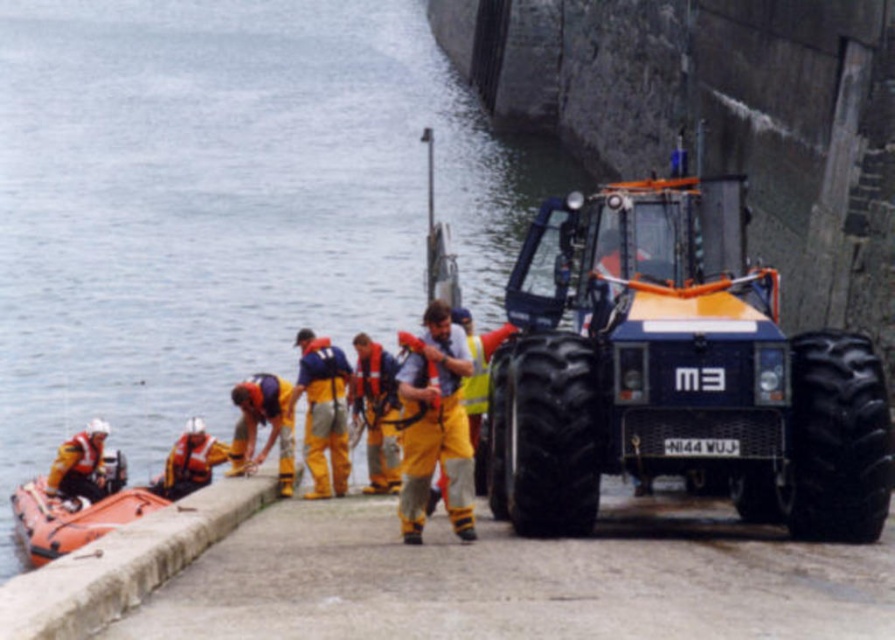
You are a safety inspector at the harbor. You need to ensure that the orange rubber boat at lower left can safely launch into the smooth water at lower left. Based on the scene, is the height difference between them a concern for launching the boat?

The smooth water at lower left is taller than the orange rubber boat at lower left. This means the water level is higher than the boat, which could make launching easier as the boat can be placed directly into the water without needing to overcome a height barrier.

You are a safety inspector at the harbor. You notice two items in the scene that need inspection. One is the yellow waterproof suit at center and the other is the orange rubber boat at lower left. Based on their positions, which item is closer to the heavy vehicle with license plate NI44 WUJ?

The orange rubber boat at lower left is closer to the heavy vehicle with license plate NI44 WUJ because the yellow waterproof suit at center is positioned on the right side of the orange rubber boat at lower left, meaning the orange rubber boat is between the vehicle and the suit.

You are a safety inspector at the harbor. You need to ensure that the yellow waterproof suit at center and the orange rubber boat at lower left are within a 5 meter safety distance. Based on the scene provided, is this requirement met?

The yellow waterproof suit at center and the orange rubber boat at lower left are 6.18 meters apart from each other. Since 6.18 meters exceeds the 5 meter safety distance requirement, the requirement is not met.